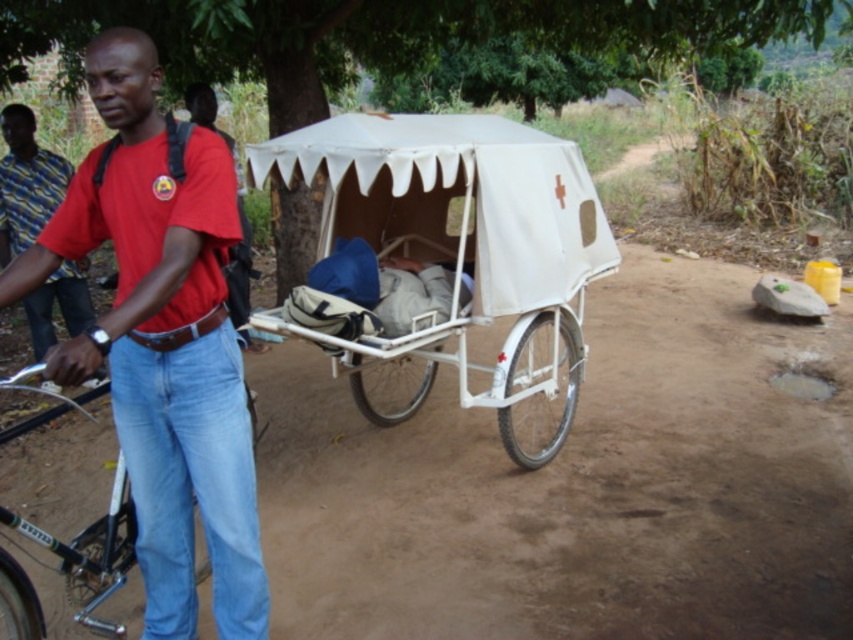
Question: Is matte red shirt at center wider than red cotton shirt at left?

Choices:
 (A) no
 (B) yes

Answer: (A)

Question: Can you confirm if matte red shirt at center is positioned to the right of black matte bicycle at left?

Choices:
 (A) no
 (B) yes

Answer: (B)

Question: Which point is farther to the camera?

Choices:
 (A) (9, 115)
 (B) (601, 493)
 (C) (338, 177)
 (D) (97, 204)

Answer: (A)

Question: Is white matte wagon at center smaller than black matte bicycle at left?

Choices:
 (A) yes
 (B) no

Answer: (B)

Question: Which point is farther from the camera taking this photo?

Choices:
 (A) (555, 234)
 (B) (4, 202)
 (C) (467, 467)
 (D) (44, 392)

Answer: (D)

Question: Which point is farther from the camera taking this photo?

Choices:
 (A) (73, 305)
 (B) (335, 388)

Answer: (B)